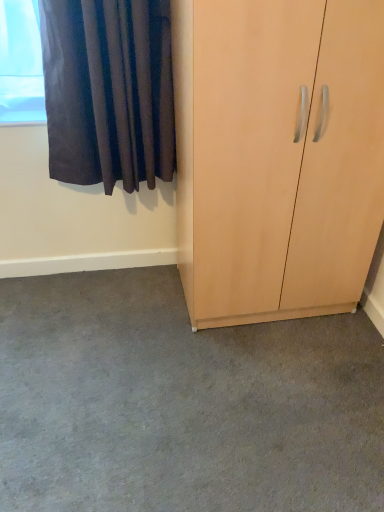
This screenshot has height=512, width=384. Find the location of `vacant area to the left of light wood cupboard at right`. vacant area to the left of light wood cupboard at right is located at coordinates (123, 315).